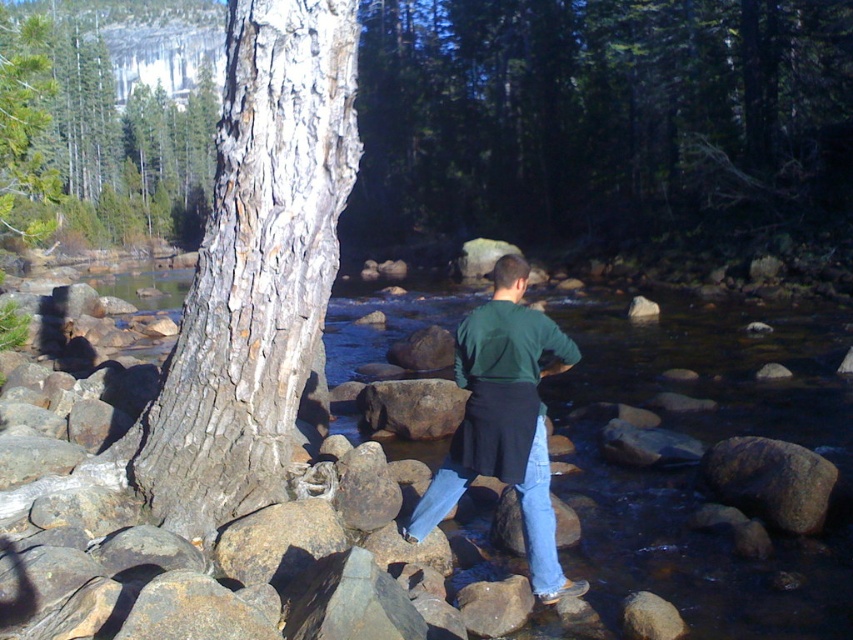
You are a hiker who needs to cross from the smooth bark tree at upper left to the brown rough rock at center. Given that your average walking pace is 1.5 meters per second, how long will it take you to walk between them?

The distance between the smooth bark tree at upper left and the brown rough rock at center is 25.02 meters. At a pace of 1.5 meters per second, it would take approximately 16.68 seconds to walk between them.

You are a hiker who wants to take a photo of the smooth bark tree at upper left and the brown rough rock at center. Which object is positioned more to the left in the scene?

The smooth bark tree at upper left is positioned more to the left than the brown rough rock at center.